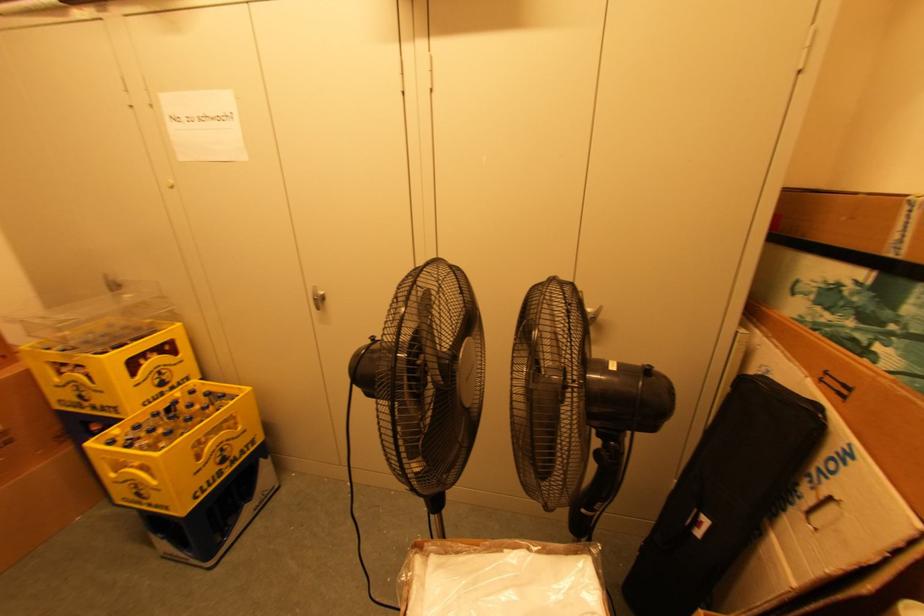
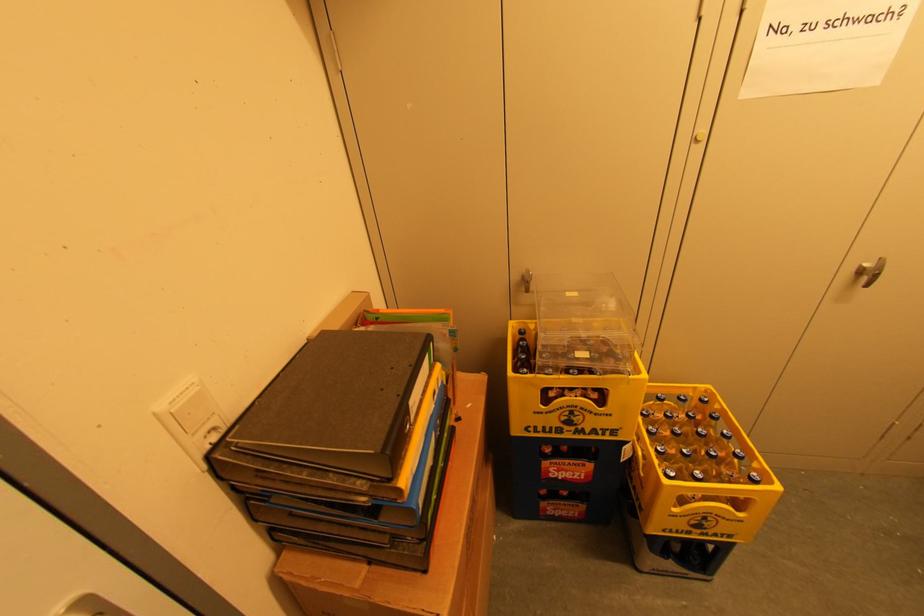
Find the pixel in the second image that matches point (159, 507) in the first image.

(718, 535)